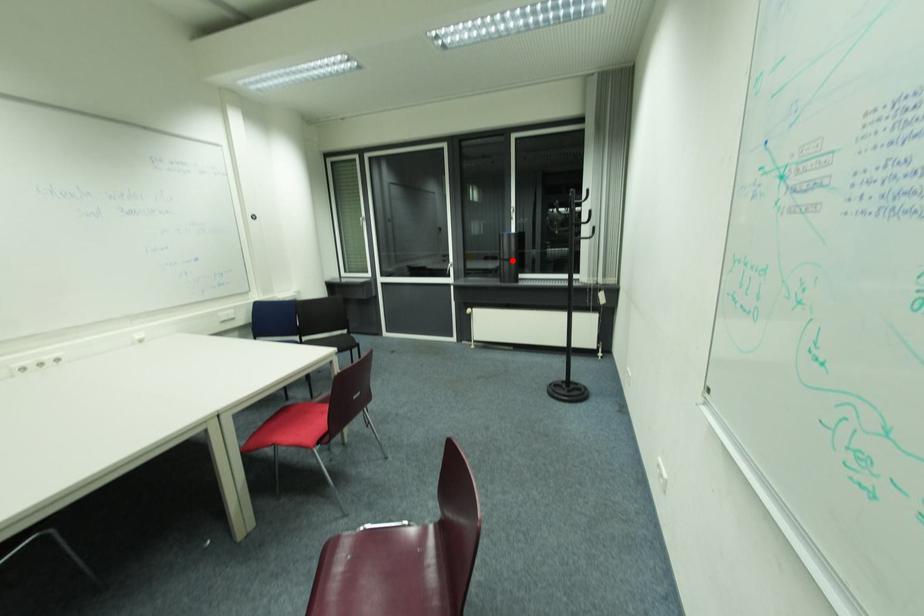
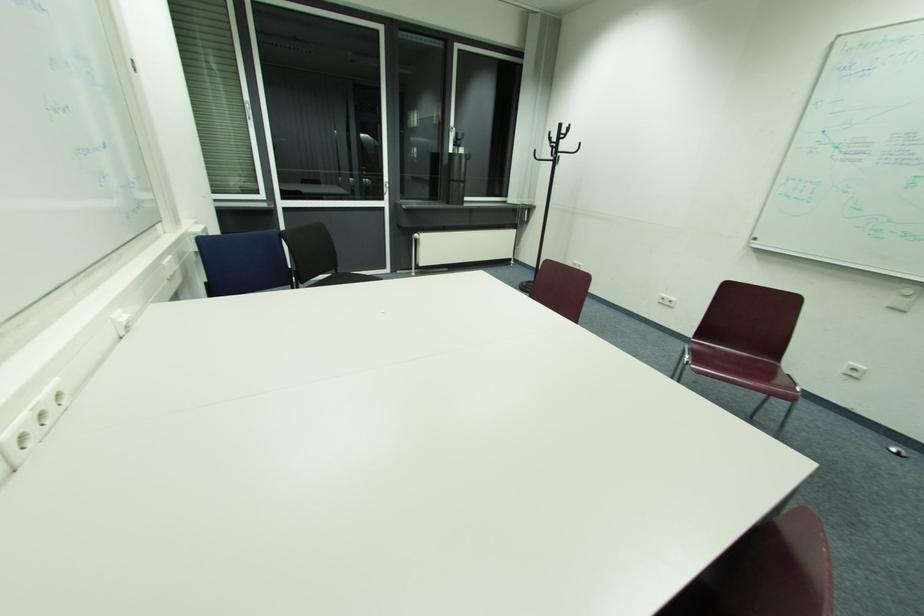
Where in the second image is the point corresponding to the highlighted location from the first image?

(464, 182)